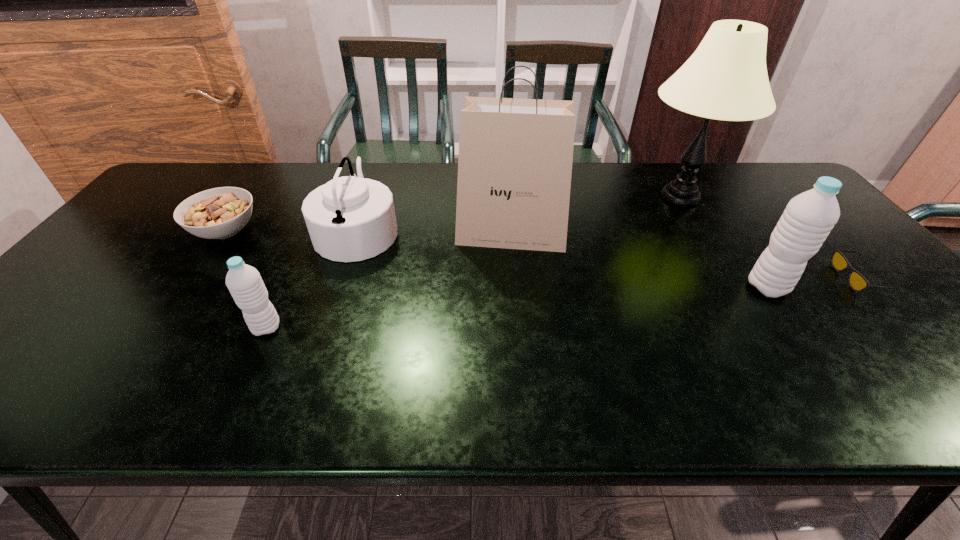
Find the location of a particular element. The width and height of the screenshot is (960, 540). free point between the fourth object from right to left and the lamp is located at coordinates (595, 216).

You are a GUI agent. You are given a task and a screenshot of the screen. Output one action in this format:
    pyautogui.click(x=<x>, y=<y>)
    Task: Click on the free area in between the shortest object and the lamp
    
    Given the screenshot: What is the action you would take?
    pyautogui.click(x=769, y=238)

Where is `vacant region between the sixth tallest object and the shortest object`? The height and width of the screenshot is (540, 960). vacant region between the sixth tallest object and the shortest object is located at coordinates (541, 255).

I want to click on vacant point located between the shorter water bottle and the rightmost object, so click(x=563, y=303).

The width and height of the screenshot is (960, 540). In order to click on free space between the lamp and the third tallest object in this screenshot , I will do `click(724, 242)`.

Find the location of a particular element. vacant space that is in between the shopping bag and the shortest object is located at coordinates (684, 256).

Where is `object that ranks as the closest to the stew`? The width and height of the screenshot is (960, 540). object that ranks as the closest to the stew is located at coordinates (350, 218).

The image size is (960, 540). Identify the location of the second closest object to the shorter water bottle. (218, 213).

Find the location of a particular element. Image resolution: width=960 pixels, height=540 pixels. vacant region that satisfies the following two spatial constraints: 1. on the spout of the kettle; 2. on the left side of the taller water bottle is located at coordinates (339, 287).

This screenshot has width=960, height=540. Identify the location of blank area in the image that satisfies the following two spatial constraints: 1. on the spout of the kettle; 2. on the right side of the shopping bag. (356, 234).